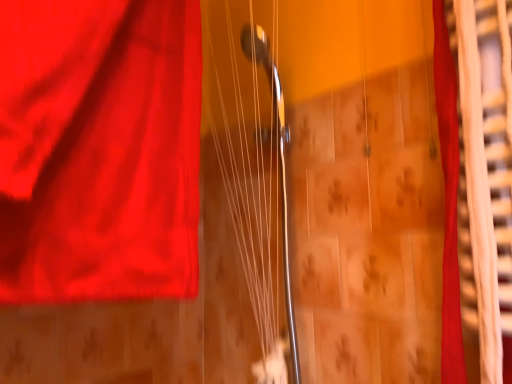
Question: Considering the positions of metallic silver strings at center and silky red curtain at right in the image, is metallic silver strings at center wider or thinner than silky red curtain at right?

Choices:
 (A) wide
 (B) thin

Answer: (A)

Question: In the image, is metallic silver strings at center positioned in front of or behind silky red curtain at right?

Choices:
 (A) behind
 (B) front

Answer: (A)

Question: From a real-world perspective, is metallic silver strings at center positioned above or below silky red curtain at right?

Choices:
 (A) above
 (B) below

Answer: (A)

Question: From the image's perspective, is silky red curtain at right above or below metallic silver strings at center?

Choices:
 (A) below
 (B) above

Answer: (B)

Question: Considering the positions of silky red curtain at right and metallic silver strings at center in the image, is silky red curtain at right wider or thinner than metallic silver strings at center?

Choices:
 (A) wide
 (B) thin

Answer: (B)

Question: In terms of height, does silky red curtain at right look taller or shorter compared to metallic silver strings at center?

Choices:
 (A) short
 (B) tall

Answer: (A)

Question: From a real-world perspective, is silky red curtain at right physically located above or below metallic silver strings at center?

Choices:
 (A) below
 (B) above

Answer: (A)